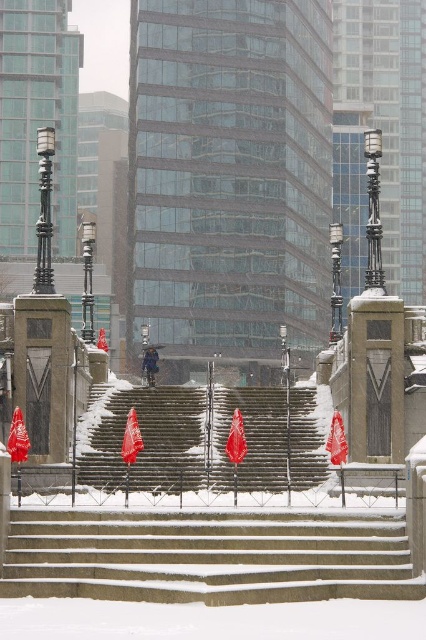
Question: Which object appears closest to the camera in this image?

Choices:
 (A) snow-covered concrete stairs at lower center
 (B) snow-covered stone stairs at center
 (C) white snowsuit at center

Answer: (A)

Question: Can you confirm if snow-covered concrete stairs at lower center is thinner than white snowsuit at center?

Choices:
 (A) yes
 (B) no

Answer: (B)

Question: Can you confirm if snow-covered concrete stairs at lower center is smaller than snow-covered stone stairs at center?

Choices:
 (A) no
 (B) yes

Answer: (B)

Question: Among these points, which one is nearest to the camera?

Choices:
 (A) (149, 369)
 (B) (259, 435)
 (C) (322, 564)

Answer: (C)

Question: Based on their relative distances, which object is nearer to the snow-covered stone stairs at center?

Choices:
 (A) snow-covered concrete stairs at lower center
 (B) white snowsuit at center

Answer: (B)

Question: Does snow-covered concrete stairs at lower center lie behind white snowsuit at center?

Choices:
 (A) yes
 (B) no

Answer: (B)